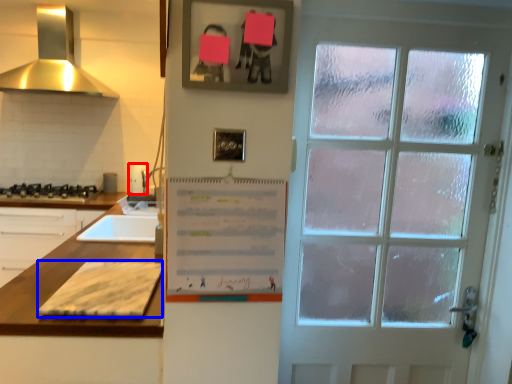
Question: Which object appears farthest to the camera in this image, appliance (highlighted by a red box) or cardboard (highlighted by a blue box)?

Choices:
 (A) appliance
 (B) cardboard

Answer: (A)